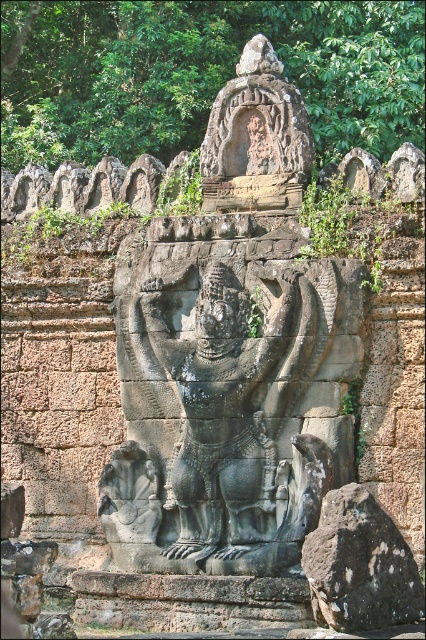
Between black stone deity at center and black rough rock at lower right, which one has less height?

black rough rock at lower right

What do you see at coordinates (229, 401) in the screenshot? I see `black stone deity at center` at bounding box center [229, 401].

Identify the location of black stone deity at center. (229, 401).